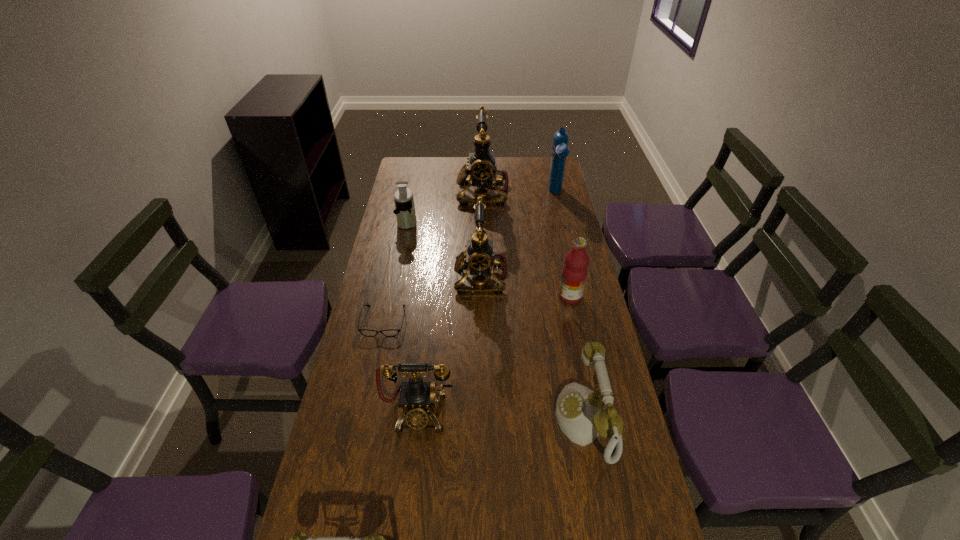
Locate an element on the screen. This screenshot has width=960, height=540. free space between the shampoo and the bigger white telephone is located at coordinates (571, 307).

Where is `vacant space that is in between the rightmost telephone and the fruit juice`? This screenshot has width=960, height=540. vacant space that is in between the rightmost telephone and the fruit juice is located at coordinates (578, 358).

The image size is (960, 540). What are the coordinates of `free point between the fourth nearest object and the farther white telephone` in the screenshot? It's located at point(485,371).

Where is `vacant space that is in between the bigger white telephone and the pink fruit juice`? The width and height of the screenshot is (960, 540). vacant space that is in between the bigger white telephone and the pink fruit juice is located at coordinates (578, 358).

Select which object appears as the eighth closest to the shampoo. Please provide its 2D coordinates. Your answer should be formatted as a tuple, i.e. [(x, y)], where the tuple contains the x and y coordinates of a point satisfying the conditions above.

[(300, 539)]

Identify which object is the sixth closest to the rightmost telephone. Please provide its 2D coordinates. Your answer should be formatted as a tuple, i.e. [(x, y)], where the tuple contains the x and y coordinates of a point satisfying the conditions above.

[(405, 212)]

You are a GUI agent. You are given a task and a screenshot of the screen. Output one action in this format:
    pyautogui.click(x=<x>, y=<y>)
    Task: Click on the fourth closest telephone relative to the nearer white telephone
    The image size is (960, 540).
    Given the screenshot: What is the action you would take?
    click(x=483, y=172)

Identify which telephone is the closest to the shampoo. Please provide its 2D coordinates. Your answer should be formatted as a tuple, i.e. [(x, y)], where the tuple contains the x and y coordinates of a point satisfying the conditions above.

[(483, 172)]

At what (x,y) coordinates should I click in order to perform the action: click on the closest black telephone to the tallest telephone. Please return your answer as a coordinate pair (x, y). Looking at the image, I should click on (479, 257).

You are a GUI agent. You are given a task and a screenshot of the screen. Output one action in this format:
    pyautogui.click(x=<x>, y=<y>)
    Task: Click on the third closest black telephone relative to the spectacles
    
    Given the screenshot: What is the action you would take?
    (x=483, y=172)